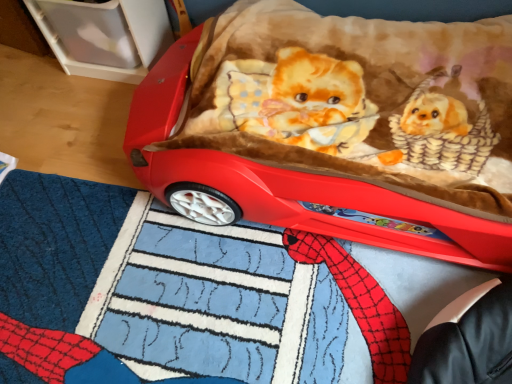
At what (x,y) coordinates should I click in order to perform the action: click on blue plush mat at lower center. Please return your answer as a coordinate pair (x, y). The image size is (512, 384). Looking at the image, I should click on (180, 296).

What do you see at coordinates (180, 296) in the screenshot? Image resolution: width=512 pixels, height=384 pixels. I see `blue plush mat at lower center` at bounding box center [180, 296].

What is the approximate height of matte plastic car at center?

matte plastic car at center is 9.21 inches tall.

The image size is (512, 384). Describe the element at coordinates (337, 128) in the screenshot. I see `matte plastic car at center` at that location.

At what (x,y) coordinates should I click in order to perform the action: click on matte plastic car at center. Please return your answer as a coordinate pair (x, y). The height and width of the screenshot is (384, 512). Looking at the image, I should click on (337, 128).

Where is `blue plush mat at lower center`? Image resolution: width=512 pixels, height=384 pixels. blue plush mat at lower center is located at coordinates (180, 296).

Which object is positioned more to the right, blue plush mat at lower center or matte plastic car at center?

matte plastic car at center.

Is blue plush mat at lower center behind matte plastic car at center?

No, the depth of blue plush mat at lower center is less than that of matte plastic car at center.

Is point (322, 250) closer or farther from the camera than point (383, 65)?

Clearly, point (322, 250) is closer to the camera than point (383, 65).

From the image's perspective, is blue plush mat at lower center above or below matte plastic car at center?

Clearly, from the image's perspective, blue plush mat at lower center is below matte plastic car at center.

From a real-world perspective, who is located higher, blue plush mat at lower center or matte plastic car at center?

matte plastic car at center, from a real-world perspective.

Is blue plush mat at lower center wider or thinner than matte plastic car at center?

blue plush mat at lower center is wider than matte plastic car at center.

Between blue plush mat at lower center and matte plastic car at center, which one has more height?

Standing taller between the two is matte plastic car at center.

Who is smaller, blue plush mat at lower center or matte plastic car at center?

blue plush mat at lower center.

Is blue plush mat at lower center not within matte plastic car at center?

Yes, blue plush mat at lower center is outside of matte plastic car at center.

Is blue plush mat at lower center placed right next to matte plastic car at center?

blue plush mat at lower center and matte plastic car at center are not in contact.

Is blue plush mat at lower center looking in the opposite direction of matte plastic car at center?

That's not correct — blue plush mat at lower center is not looking away from matte plastic car at center.

At what (x,y) coordinates should I click in order to perform the action: click on toy above the blue plush mat at lower center (from the image's perspective). Please return your answer as a coordinate pair (x, y). The height and width of the screenshot is (384, 512). Looking at the image, I should click on (337, 128).

Between matte plastic car at center and blue plush mat at lower center, which one appears on the left side from the viewer's perspective?

Positioned to the left is blue plush mat at lower center.

Looking at this image, which is behind, matte plastic car at center or blue plush mat at lower center?

Positioned behind is matte plastic car at center.

Is point (448, 95) farther from viewer compared to point (81, 251)?

That is True.

From the image's perspective, is matte plastic car at center located above blue plush mat at lower center?

Yes, from the image's perspective, matte plastic car at center is above blue plush mat at lower center.

From a real-world perspective, which is physically below, matte plastic car at center or blue plush mat at lower center?

From a 3D spatial view, blue plush mat at lower center is below.

Which object is wider, matte plastic car at center or blue plush mat at lower center?

blue plush mat at lower center.

Is matte plastic car at center taller or shorter than blue plush mat at lower center?

matte plastic car at center is taller than blue plush mat at lower center.

Considering the sizes of objects matte plastic car at center and blue plush mat at lower center in the image provided, who is smaller, matte plastic car at center or blue plush mat at lower center?

With smaller size is blue plush mat at lower center.

Is matte plastic car at center surrounding blue plush mat at lower center?

Actually, blue plush mat at lower center is outside matte plastic car at center.

Does matte plastic car at center touch blue plush mat at lower center?

No, matte plastic car at center is not next to blue plush mat at lower center.

Is matte plastic car at center positioned with its back to blue plush mat at lower center?

No, matte plastic car at center's orientation is not away from blue plush mat at lower center.

How many degrees apart are the facing directions of matte plastic car at center and blue plush mat at lower center?

matte plastic car at center and blue plush mat at lower center are facing 0.000237 degrees away from each other.

Where is `toy behind the blue plush mat at lower center`? The image size is (512, 384). toy behind the blue plush mat at lower center is located at coordinates (x=337, y=128).

The image size is (512, 384). What are the coordinates of `mat lying in front of the matte plastic car at center` in the screenshot? It's located at (180, 296).

Find the location of a particular element. Image resolution: width=512 pixels, height=384 pixels. toy above the blue plush mat at lower center (from a real-world perspective) is located at coordinates (337, 128).